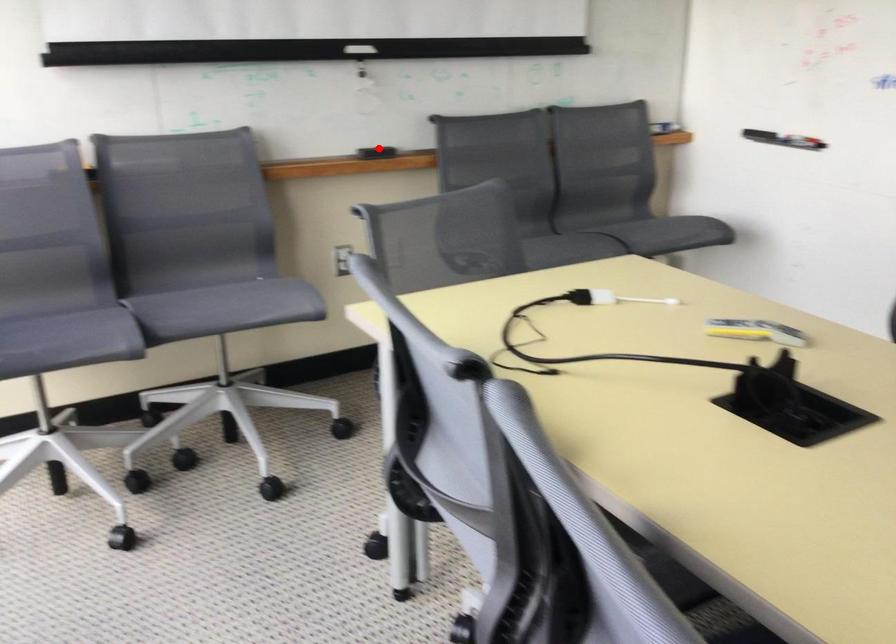
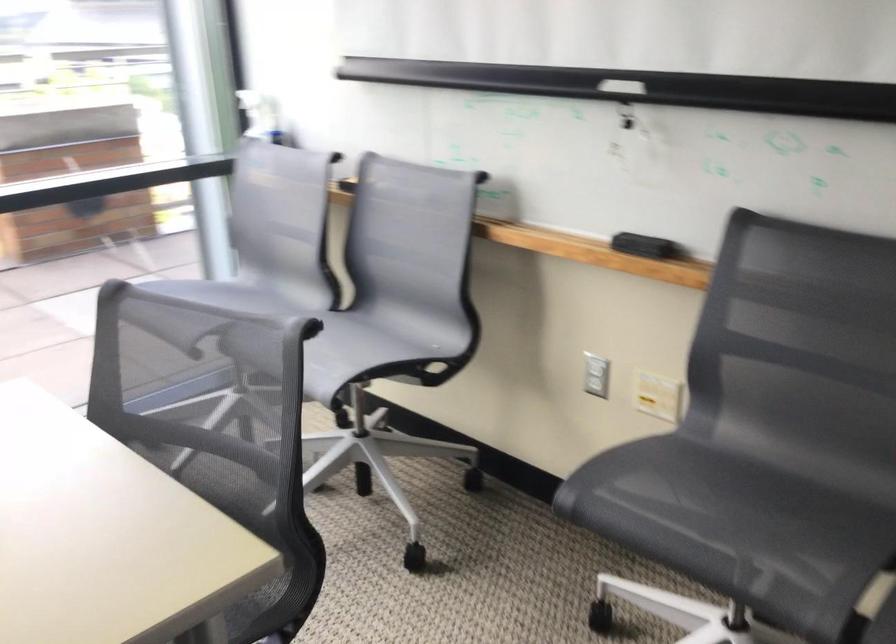
Question: I am providing you with two images of the same scene from different viewpoints. Image1 has a red point marked. In image2, the corresponding 3D location appears at what relative position? Reply with the corresponding letter.

Choices:
 (A) Closer
 (B) Farther

Answer: (A)